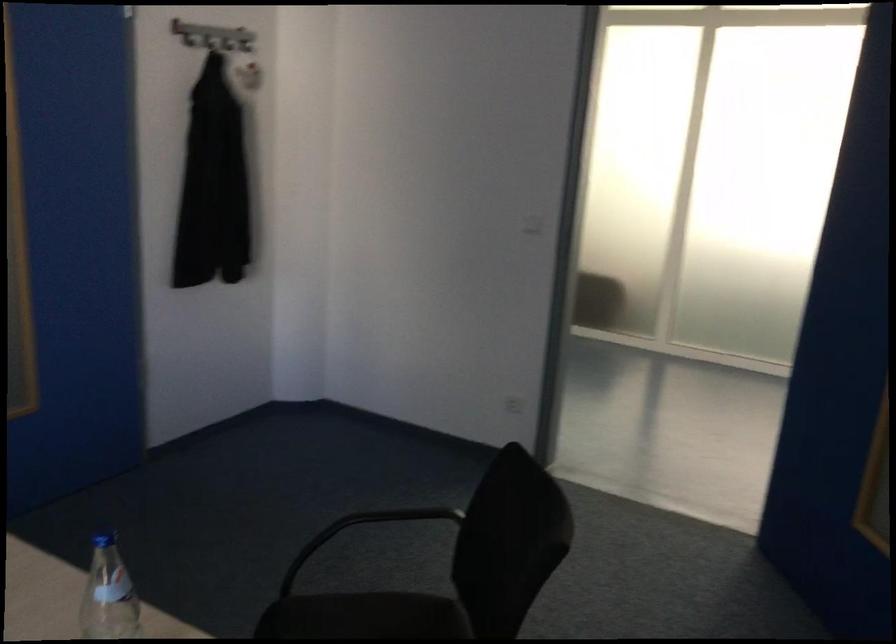
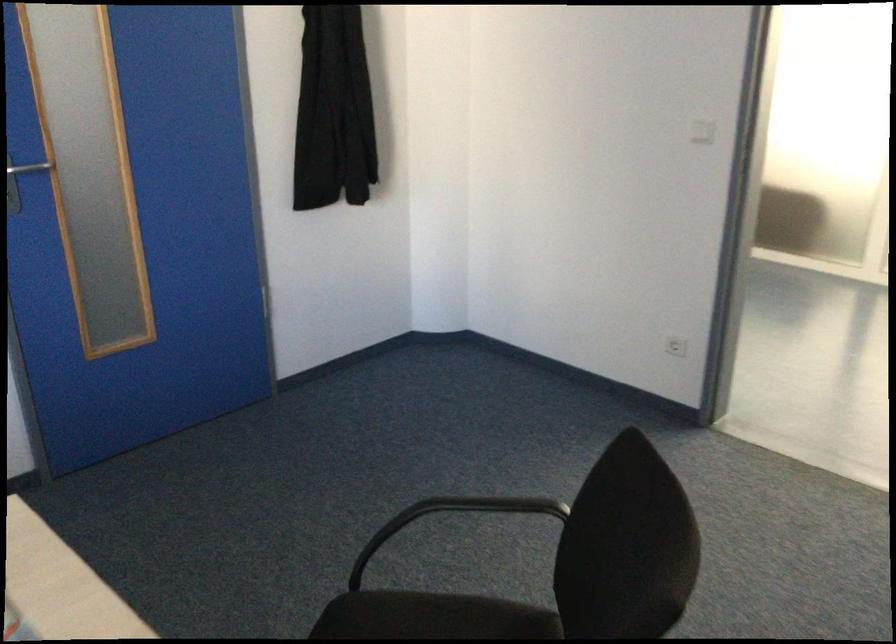
Question: The camera is either moving clockwise (left) or counter-clockwise (right) around the object. The first image is from the beginning of the video and the second image is from the end. Is the camera moving left or right when shooting the video?

Choices:
 (A) Left
 (B) Right

Answer: (B)